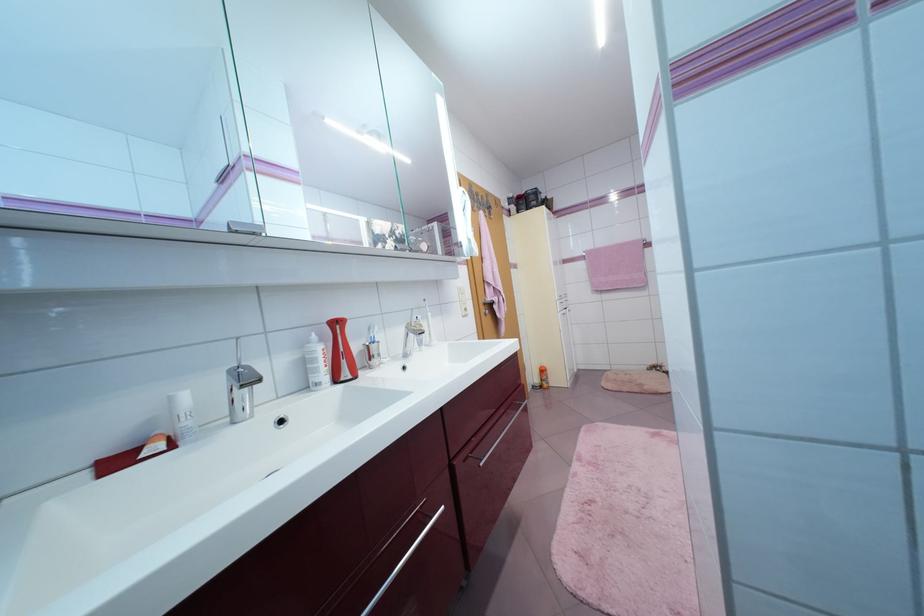
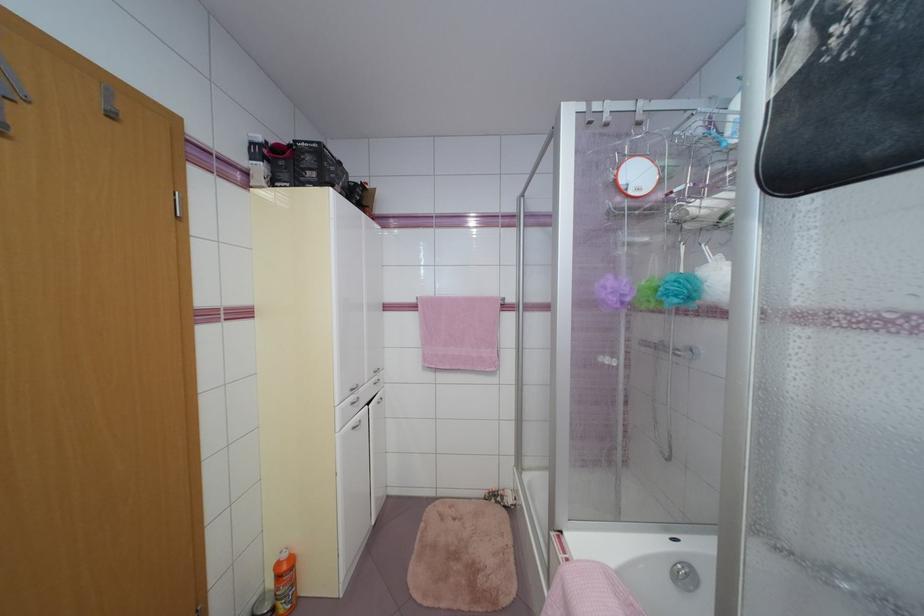
Locate, in the second image, the point that corresponds to pixel 524 213 in the first image.

(276, 185)